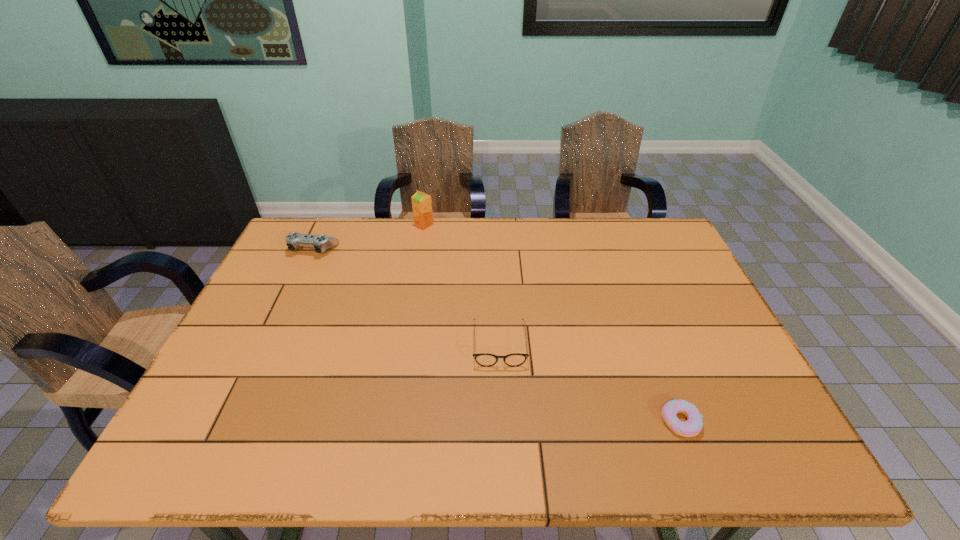
You are a GUI agent. You are given a task and a screenshot of the screen. Output one action in this format:
    pyautogui.click(x=<x>, y=<y>)
    Task: Click on the farthest object
    
    Given the screenshot: What is the action you would take?
    pyautogui.click(x=421, y=202)

This screenshot has width=960, height=540. I want to click on the tallest object, so click(x=421, y=202).

Locate an element on the screen. This screenshot has height=540, width=960. the leftmost object is located at coordinates (321, 243).

I want to click on control, so click(x=321, y=243).

This screenshot has height=540, width=960. Find the location of `spectacles`. spectacles is located at coordinates (484, 359).

At what (x,y) coordinates should I click in order to perform the action: click on the third object from left to right. Please return your answer as a coordinate pair (x, y). Looking at the image, I should click on (484, 359).

The image size is (960, 540). I want to click on the shortest object, so click(694, 424).

You are a GUI agent. You are given a task and a screenshot of the screen. Output one action in this format:
    pyautogui.click(x=<x>, y=<y>)
    Task: Click on the nearest object
    This screenshot has width=960, height=540.
    Given the screenshot: What is the action you would take?
    pyautogui.click(x=694, y=424)

Where is `vacant point located on the left of the orange juice`? vacant point located on the left of the orange juice is located at coordinates (335, 225).

Identify the location of vacant space situated on the front of the control. This screenshot has height=540, width=960. (298, 284).